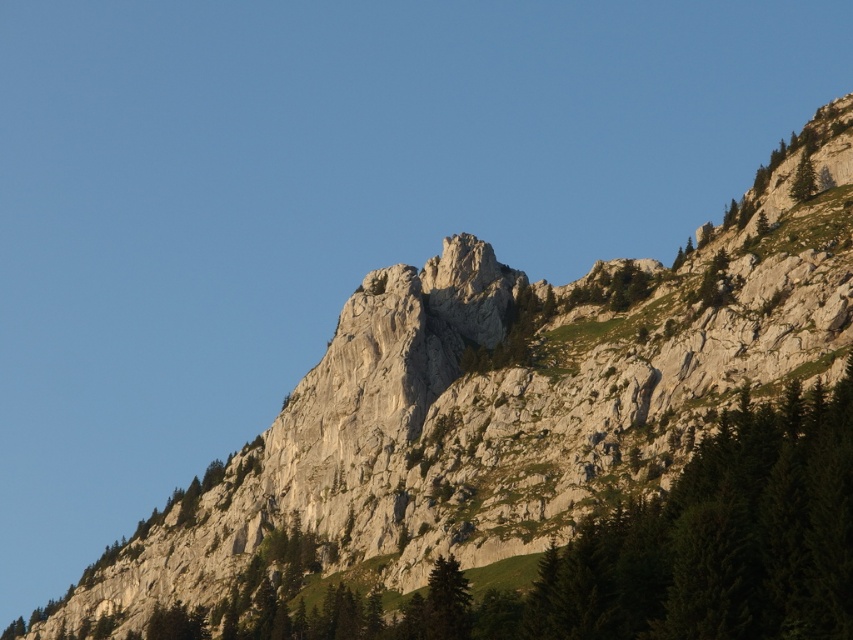
Can you confirm if green matte tree at lower center is thinner than green textured tree at upper right?

Yes, green matte tree at lower center is thinner than green textured tree at upper right.

In the scene shown: Who is positioned more to the left, green matte tree at lower center or green textured tree at upper right?

green matte tree at lower center is more to the left.

Locate an element on the screen. This screenshot has width=853, height=640. green matte tree at lower center is located at coordinates (445, 602).

This screenshot has height=640, width=853. I want to click on green matte tree at lower center, so click(x=445, y=602).